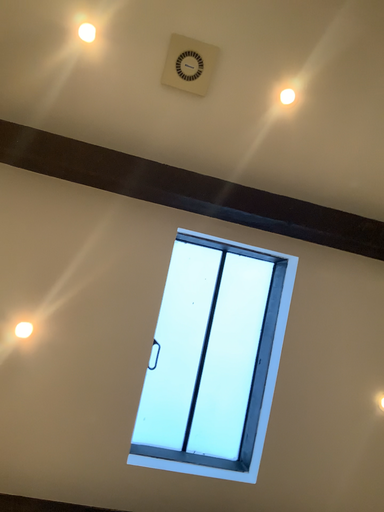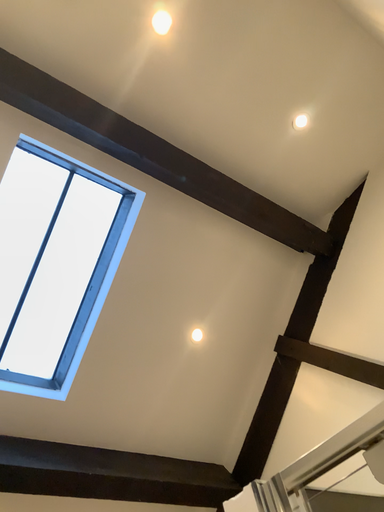
Question: How did the camera likely rotate when shooting the video?

Choices:
 (A) rotated right
 (B) rotated left

Answer: (A)